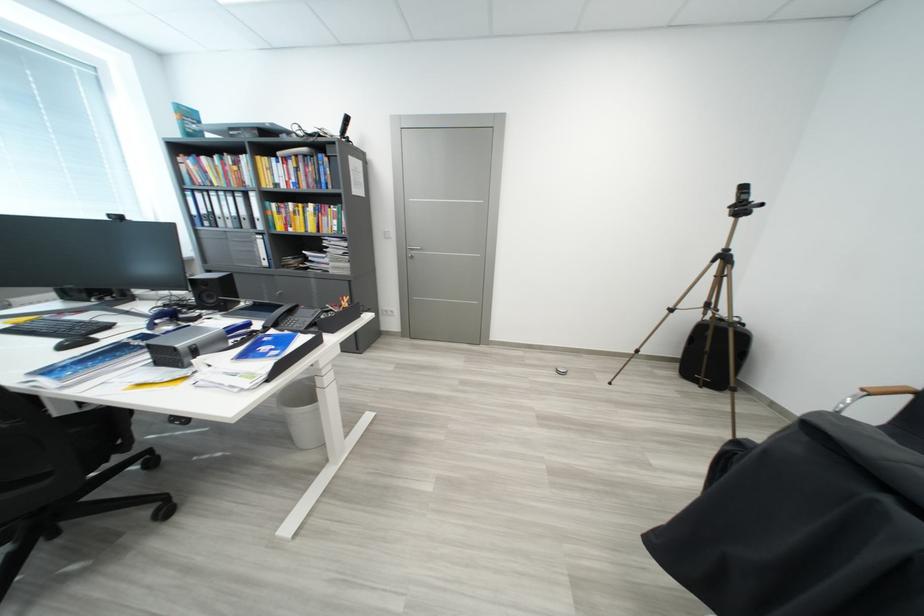
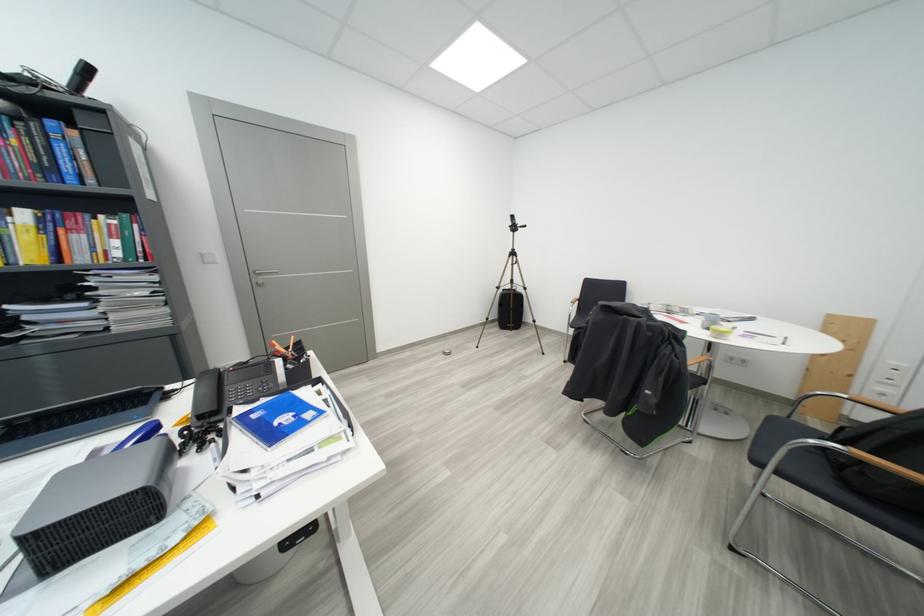
In the second image, find the point that corresponds to [679,313] in the first image.

(506, 291)